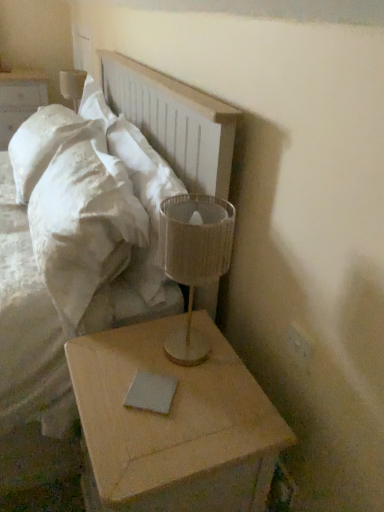
Locate an element on the screen. This screenshot has height=512, width=384. free space to the right of gray matte notepad at lower center is located at coordinates (220, 398).